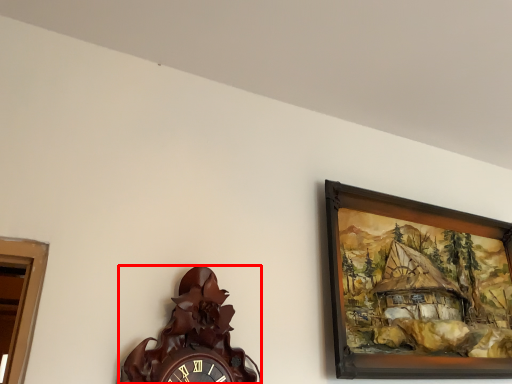
Question: From the image's perspective, where is wall clock (annotated by the red box) located in relation to picture frame in the image?

Choices:
 (A) above
 (B) below

Answer: (B)